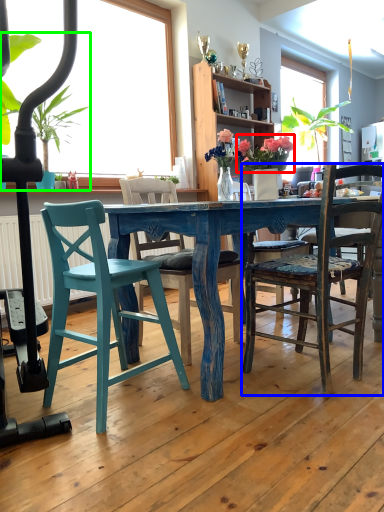
Question: Which object is positioned farthest from floral arrangement (highlighted by a red box)? Select from chair (highlighted by a blue box) and houseplant (highlighted by a green box).

Choices:
 (A) chair
 (B) houseplant

Answer: (B)